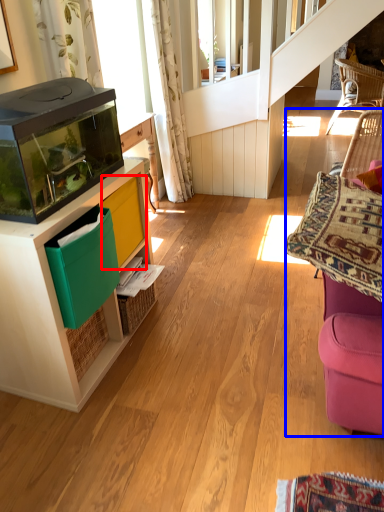
Question: Which object appears closest to the camera in this image, shelf (highlighted by a red box) or swivel chair (highlighted by a blue box)?

Choices:
 (A) shelf
 (B) swivel chair

Answer: (B)